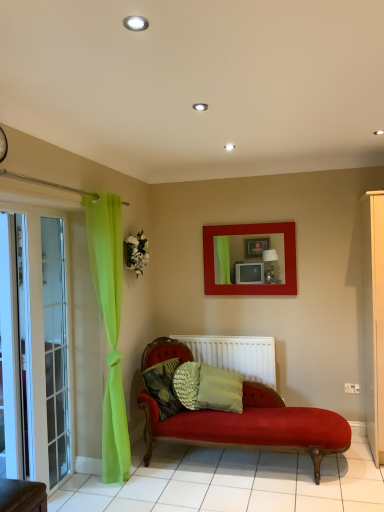
What is the approximate width of transparent glass screen door at left, marked as the second screen door in a front-to-back arrangement?

transparent glass screen door at left, marked as the second screen door in a front-to-back arrangement, is 3.84 inches wide.

The height and width of the screenshot is (512, 384). Find the location of `transparent glass screen door at left, marked as the second screen door in a front-to-back arrangement`. transparent glass screen door at left, marked as the second screen door in a front-to-back arrangement is located at coordinates (10, 351).

This screenshot has height=512, width=384. What do you see at coordinates (236, 354) in the screenshot?
I see `white matte radiator at center` at bounding box center [236, 354].

This screenshot has height=512, width=384. Identify the location of white matte radiator at center. (236, 354).

Image resolution: width=384 pixels, height=512 pixels. I want to click on clear glass door at left, so click(55, 348).

The image size is (384, 512). Describe the element at coordinates (162, 386) in the screenshot. I see `textured green pillow at center` at that location.

In order to click on matte red picture frame at center in this screenshot , I will do click(244, 234).

This screenshot has width=384, height=512. I want to click on transparent glass screen door at left, marked as the second screen door in a front-to-back arrangement, so click(10, 351).

Which of these two, transparent glass screen door at left, marked as the second screen door in a front-to-back arrangement, or textured green pillow at center, is wider?

With larger width is textured green pillow at center.

This screenshot has height=512, width=384. Find the location of `screen door that is the 1st object located in front of the textured green pillow at center`. screen door that is the 1st object located in front of the textured green pillow at center is located at coordinates (10, 351).

Is transparent glass screen door at left, marked as the second screen door in a front-to-back arrangement, far away from textured green pillow at center?

Yes, transparent glass screen door at left, marked as the second screen door in a front-to-back arrangement, and textured green pillow at center are located far from each other.

From the image's perspective, which object appears higher, transparent glass screen door at left, marked as the second screen door in a front-to-back arrangement, or textured green pillow at center?

transparent glass screen door at left, marked as the second screen door in a front-to-back arrangement, appears higher in the image.

Is transparent glass screen door at left, which is the 1th screen door in back-to-front order, at the back of white matte radiator at center?

No.

At what (x,y) coordinates should I click in order to perform the action: click on radiator behind the transparent glass screen door at left, marked as the second screen door in a front-to-back arrangement. Please return your answer as a coordinate pair (x, y). Looking at the image, I should click on (236, 354).

From a real-world perspective, is white matte radiator at center on transparent glass screen door at left, which is the 1th screen door in back-to-front order?

No, from a real-world perspective, white matte radiator at center is not above transparent glass screen door at left, which is the 1th screen door in back-to-front order.

Choose the correct answer: Is white matte radiator at center inside transparent glass screen door at left, marked as the second screen door in a front-to-back arrangement, or outside it?

white matte radiator at center is located beyond the bounds of transparent glass screen door at left, marked as the second screen door in a front-to-back arrangement.

In the image, is white glass screen door at left, arranged as the 2th screen door when viewed from the back, on the left side or the right side of clear glass door at left?

white glass screen door at left, arranged as the 2th screen door when viewed from the back, is positioned on clear glass door at left's left side.

Looking at this image, would you say white glass screen door at left, which is counted as the 1th screen door, starting from the front, contains clear glass door at left?

No, clear glass door at left is located outside of white glass screen door at left, which is counted as the 1th screen door, starting from the front.

From the image's perspective, is white glass screen door at left, which is counted as the 1th screen door, starting from the front, on clear glass door at left?

Yes, from the image's perspective, white glass screen door at left, which is counted as the 1th screen door, starting from the front, is on top of clear glass door at left.

How different are the orientations of white glass screen door at left, arranged as the 2th screen door when viewed from the back, and clear glass door at left in degrees?

The angle between the facing direction of white glass screen door at left, arranged as the 2th screen door when viewed from the back, and the facing direction of clear glass door at left is 2.52 degrees.

Which object is closer to the camera, white glass screen door at left, arranged as the 2th screen door when viewed from the back, or white matte radiator at center?

Positioned in front is white glass screen door at left, arranged as the 2th screen door when viewed from the back.

What's the angular difference between white glass screen door at left, arranged as the 2th screen door when viewed from the back, and white matte radiator at center's facing directions?

88.3 degrees.

How distant is white glass screen door at left, which is counted as the 1th screen door, starting from the front, from white matte radiator at center?

They are 5.23 feet apart.

From the image's perspective, between white glass screen door at left, arranged as the 2th screen door when viewed from the back, and white matte radiator at center, which one is located above?

white glass screen door at left, arranged as the 2th screen door when viewed from the back, appears higher in the image.

From the picture: In terms of height, does clear glass door at left look taller or shorter compared to white matte radiator at center?

Considering their sizes, clear glass door at left has more height than white matte radiator at center.

How many degrees apart are the facing directions of clear glass door at left and white matte radiator at center?

The angular difference between clear glass door at left and white matte radiator at center is 85.8 degrees.

From a real-world perspective, between clear glass door at left and white matte radiator at center, who is vertically lower?

white matte radiator at center is physically lower.

In the scene shown: Is clear glass door at left spatially inside white matte radiator at center, or outside of it?

clear glass door at left lies outside white matte radiator at center.

Which is nearer, (x=10, y=331) or (x=217, y=342)?

The point (x=10, y=331) is more forward.

From a real-world perspective, is transparent glass screen door at left, which is the 1th screen door in back-to-front order, physically located above or below white matte radiator at center?

From a real-world perspective, transparent glass screen door at left, which is the 1th screen door in back-to-front order, is physically above white matte radiator at center.

How many degrees apart are the facing directions of transparent glass screen door at left, which is the 1th screen door in back-to-front order, and white matte radiator at center?

The angular difference between transparent glass screen door at left, which is the 1th screen door in back-to-front order, and white matte radiator at center is 0.683 degrees.

Looking at this image, is transparent glass screen door at left, which is the 1th screen door in back-to-front order, further to camera compared to white matte radiator at center?

No, it is in front of white matte radiator at center.

Which of these two, white glass screen door at left, arranged as the 2th screen door when viewed from the back, or textured green pillow at center, is smaller?

textured green pillow at center is smaller.

Is white glass screen door at left, which is counted as the 1th screen door, starting from the front, shorter than textured green pillow at center?

In fact, white glass screen door at left, which is counted as the 1th screen door, starting from the front, may be taller than textured green pillow at center.

Can you tell me how much white glass screen door at left, arranged as the 2th screen door when viewed from the back, and textured green pillow at center differ in facing direction?

13.9 degrees.

Identify the location of the 1st screen door above the textured green pillow at center (from a real-world perspective). click(30, 362).

Where is `pillow on the right of transparent glass screen door at left, which is the 1th screen door in back-to-front order`? The width and height of the screenshot is (384, 512). pillow on the right of transparent glass screen door at left, which is the 1th screen door in back-to-front order is located at coordinates (162, 386).

The image size is (384, 512). In order to click on radiator below the transparent glass screen door at left, which is the 1th screen door in back-to-front order (from the image's perspective) in this screenshot , I will do `click(236, 354)`.

From the image, which object appears to be farther from transparent glass screen door at left, marked as the second screen door in a front-to-back arrangement, white glass screen door at left, arranged as the 2th screen door when viewed from the back, or white matte radiator at center?

Among the two, white matte radiator at center is located further to transparent glass screen door at left, marked as the second screen door in a front-to-back arrangement.

When comparing their distances from matte red picture frame at center, does white matte radiator at center or textured green pillow at center seem further?

The object further to matte red picture frame at center is textured green pillow at center.

From the image, which object appears to be farther from matte red picture frame at center, transparent glass screen door at left, which is the 1th screen door in back-to-front order, or white glass screen door at left, which is counted as the 1th screen door, starting from the front?

transparent glass screen door at left, which is the 1th screen door in back-to-front order, lies further to matte red picture frame at center than the other object.

When comparing their distances from transparent glass screen door at left, which is the 1th screen door in back-to-front order, does white matte radiator at center or matte red picture frame at center seem further?

matte red picture frame at center lies further to transparent glass screen door at left, which is the 1th screen door in back-to-front order, than the other object.

Considering their positions, is matte red picture frame at center positioned closer to white glass screen door at left, arranged as the 2th screen door when viewed from the back, than transparent glass screen door at left, marked as the second screen door in a front-to-back arrangement?

The object closer to white glass screen door at left, arranged as the 2th screen door when viewed from the back, is transparent glass screen door at left, marked as the second screen door in a front-to-back arrangement.

Estimate the real-world distances between objects in this image. Which object is closer to clear glass door at left, matte red picture frame at center or textured green pillow at center?

Among the two, textured green pillow at center is located nearer to clear glass door at left.

When comparing their distances from transparent glass screen door at left, marked as the second screen door in a front-to-back arrangement, does matte red picture frame at center or textured green pillow at center seem closer?

textured green pillow at center.

Estimate the real-world distances between objects in this image. Which object is further from clear glass door at left, white matte radiator at center or matte red picture frame at center?

Based on the image, matte red picture frame at center appears to be further to clear glass door at left.

The image size is (384, 512). I want to click on glass door between transparent glass screen door at left, marked as the second screen door in a front-to-back arrangement, and white matte radiator at center from left to right, so click(x=55, y=348).

This screenshot has height=512, width=384. Identify the location of screen door between transparent glass screen door at left, marked as the second screen door in a front-to-back arrangement, and textured green pillow at center, in the horizontal direction. (30, 362).

What are the coordinates of `radiator between white glass screen door at left, which is counted as the 1th screen door, starting from the front, and matte red picture frame at center, in the horizontal direction` in the screenshot? It's located at (236, 354).

Where is `glass door between transparent glass screen door at left, marked as the second screen door in a front-to-back arrangement, and matte red picture frame at center`? The width and height of the screenshot is (384, 512). glass door between transparent glass screen door at left, marked as the second screen door in a front-to-back arrangement, and matte red picture frame at center is located at coordinates (55, 348).